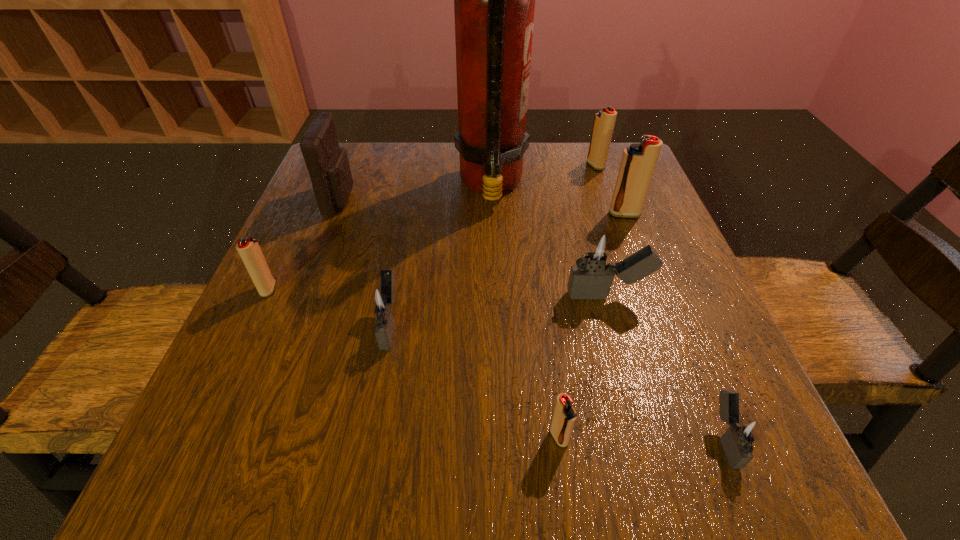
Where is `vacant space at the far right corner of the desktop`? This screenshot has height=540, width=960. vacant space at the far right corner of the desktop is located at coordinates (582, 158).

The width and height of the screenshot is (960, 540). Identify the location of vacant area at the near right corner of the desktop. (689, 475).

This screenshot has height=540, width=960. I want to click on free space between the smallest gray igniter and the leftmost object, so click(x=496, y=363).

You are a GUI agent. You are given a task and a screenshot of the screen. Output one action in this format:
    pyautogui.click(x=<x>, y=<y>)
    Task: Click on the free point between the leftmost gray igniter and the farthest igniter
    The height and width of the screenshot is (540, 960).
    Given the screenshot: What is the action you would take?
    pyautogui.click(x=493, y=245)

The width and height of the screenshot is (960, 540). Find the location of `vacant area between the nearest gray igniter and the second gray igniter from left to right`. vacant area between the nearest gray igniter and the second gray igniter from left to right is located at coordinates (666, 367).

This screenshot has height=540, width=960. Find the location of `vacant point located between the sixth igniter from right to left and the biggest gray igniter`. vacant point located between the sixth igniter from right to left and the biggest gray igniter is located at coordinates (499, 309).

Identify the location of free space between the pouch and the smallest red igniter. (450, 318).

You are a GUI agent. You are given a task and a screenshot of the screen. Output one action in this format:
    pyautogui.click(x=<x>, y=<y>)
    Task: Click on the empty location between the farthest igniter and the tallest object
    
    Given the screenshot: What is the action you would take?
    pyautogui.click(x=543, y=176)

Identify the location of unoccupied position between the rightmost gray igniter and the second gray igniter from left to right. This screenshot has width=960, height=540. (666, 367).

What are the coordinates of `free point between the biggest gray igniter and the second biggest gray igniter` in the screenshot? It's located at (499, 309).